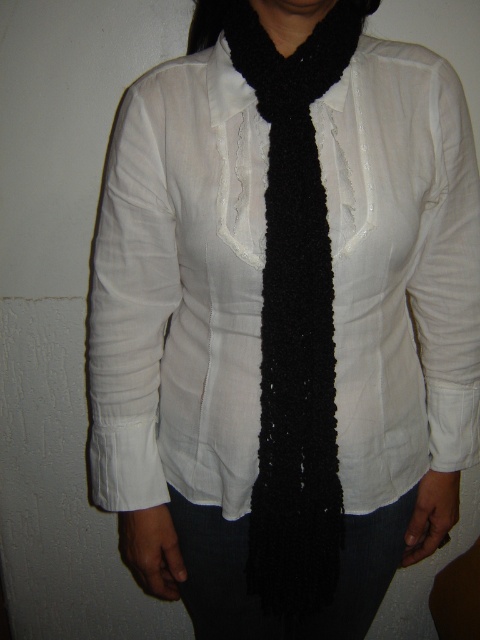
Looking at this image, you are a tailor measuring the distance between two scarves on a mannequin. The mannequin is wearing a white blouse with a ruffled neckline. You need to ensure there is at least 12 inches between the black knitted scarf at center and the black fuzzy scarf at center to allow for proper airflow. Based on the image, is the current spacing sufficient?

The distance between the black knitted scarf at center and the black fuzzy scarf at center is 10.96 inches, which is less than the required 12 inches. Therefore, the current spacing is not sufficient for proper airflow.

You are a fashion designer trying to create a new outfit. You have a white cotton blouse at center and a black knitted scarf at center. Which item is wider?

The white cotton blouse at center is wider than the black knitted scarf at center.

You are taking a photo of the person and need to focus on the closest point to the camera between the two points, point (288,198) and point (310,3). Which point should you focus on?

Point (310,3) is closer to the camera than point (288,198), so you should focus on point (310,3).